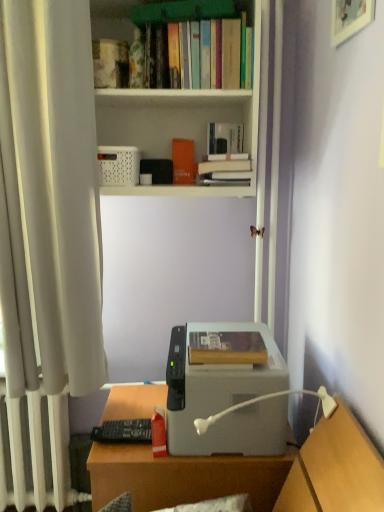
Question: Can you confirm if hardcover book at center, placed as the third book when sorted from back to front, is smaller than hardcover book at upper center, the second book from the bottom?

Choices:
 (A) yes
 (B) no

Answer: (B)

Question: Is hardcover book at center, arranged as the first book when viewed from the front, not near hardcover book at upper center, which is counted as the second book, starting from the top?

Choices:
 (A) no
 (B) yes

Answer: (A)

Question: Can we say hardcover book at center, marked as the 1th book in a bottom-to-top arrangement, lies outside hardcover book at upper center, which is counted as the second book, starting from the top?

Choices:
 (A) no
 (B) yes

Answer: (B)

Question: From a real-world perspective, is hardcover book at center, marked as the 1th book in a bottom-to-top arrangement, positioned over hardcover book at upper center, which is counted as the second book, starting from the top, based on gravity?

Choices:
 (A) yes
 (B) no

Answer: (B)

Question: Is hardcover book at center, arranged as the first book when viewed from the front, oriented away from hardcover book at upper center, which is counted as the second book, starting from the top?

Choices:
 (A) no
 (B) yes

Answer: (A)

Question: From the image's perspective, relative to wooden desk at lower center, is orange matte paperback book at upper center above or below?

Choices:
 (A) above
 (B) below

Answer: (A)

Question: Is point (178, 160) positioned closer to the camera than point (178, 490)?

Choices:
 (A) closer
 (B) farther

Answer: (B)

Question: Is orange matte paperback book at upper center taller or shorter than wooden desk at lower center?

Choices:
 (A) short
 (B) tall

Answer: (A)

Question: Relative to wooden desk at lower center, is orange matte paperback book at upper center in front or behind?

Choices:
 (A) front
 (B) behind

Answer: (B)

Question: In terms of width, does orange matte paperback book at upper center look wider or thinner when compared to hardcover books at upper center, the second book positioned from the back?

Choices:
 (A) wide
 (B) thin

Answer: (B)

Question: Would you say orange matte paperback book at upper center is inside or outside hardcover books at upper center, which is the 3th book in bottom-to-top order?

Choices:
 (A) outside
 (B) inside

Answer: (A)

Question: In the image, is orange matte paperback book at upper center on the left side or the right side of hardcover books at upper center, placed as the 2th book when sorted from front to back?

Choices:
 (A) right
 (B) left

Answer: (B)

Question: Considering their positions, is orange matte paperback book at upper center located in front of or behind hardcover books at upper center, the second book positioned from the back?

Choices:
 (A) behind
 (B) front

Answer: (A)

Question: Choose the correct answer: Is wooden picture frame at upper right inside white plastic bookcase at upper center or outside it?

Choices:
 (A) inside
 (B) outside

Answer: (B)

Question: Is wooden picture frame at upper right wider or thinner than white plastic bookcase at upper center?

Choices:
 (A) thin
 (B) wide

Answer: (A)